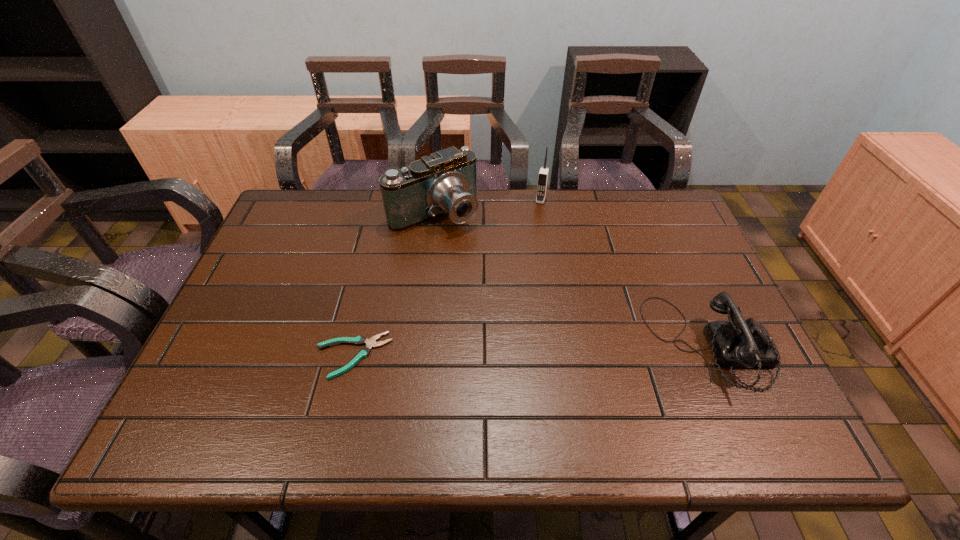
Identify the location of free spot between the camcorder and the cellular telephone. The image size is (960, 540). (488, 206).

The height and width of the screenshot is (540, 960). I want to click on vacant space in between the second object from right to left and the shortest object, so [x=446, y=278].

Where is `vacant space that is in between the telephone and the pliers`? vacant space that is in between the telephone and the pliers is located at coordinates (531, 350).

The width and height of the screenshot is (960, 540). Identify the location of object identified as the closest to the cellular telephone. (444, 183).

Where is `object that is the third nearest to the camcorder`? object that is the third nearest to the camcorder is located at coordinates (738, 343).

At what (x,y) coordinates should I click in order to perform the action: click on vacant space that satisfies the following two spatial constraints: 1. on the front side of the telephone; 2. on the front-facing side of the cellular telephone. Please return your answer as a coordinate pair (x, y). Image resolution: width=960 pixels, height=540 pixels. Looking at the image, I should click on (564, 344).